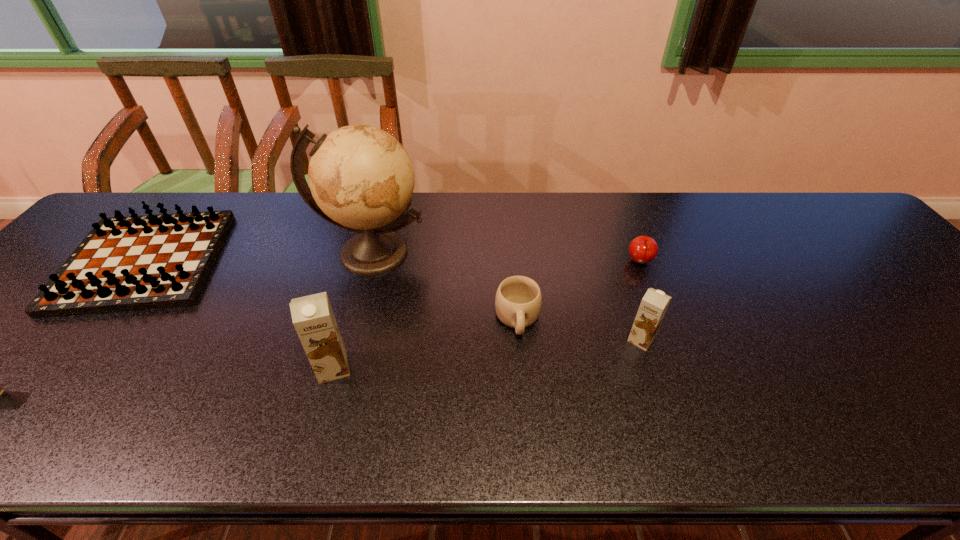
This screenshot has width=960, height=540. In the image, there is a desktop. Identify the location of vacant space at the near edge. (786, 393).

Identify the location of vacant area at the right edge of the desktop. The height and width of the screenshot is (540, 960). (924, 293).

The width and height of the screenshot is (960, 540). Find the location of `blank area at the far right corner`. blank area at the far right corner is located at coordinates (829, 215).

Locate an element on the screen. free point between the left chocolate milk and the mug is located at coordinates (425, 343).

Identify the location of blank region between the globe and the cherry. 506,258.

Where is `free space between the chessboard and the mug`? Image resolution: width=960 pixels, height=540 pixels. free space between the chessboard and the mug is located at coordinates (331, 290).

In order to click on free space between the globe and the chessboard in this screenshot , I will do `click(258, 257)`.

At what (x,y) coordinates should I click in order to perform the action: click on vacant space that's between the left chocolate milk and the fourth shortest object. Please return your answer as a coordinate pair (x, y). This screenshot has height=540, width=960. Looking at the image, I should click on click(x=487, y=354).

Image resolution: width=960 pixels, height=540 pixels. In order to click on the third closest object to the globe in this screenshot , I will do `click(130, 263)`.

The image size is (960, 540). I want to click on object that is the fifth closest one to the chessboard, so click(643, 249).